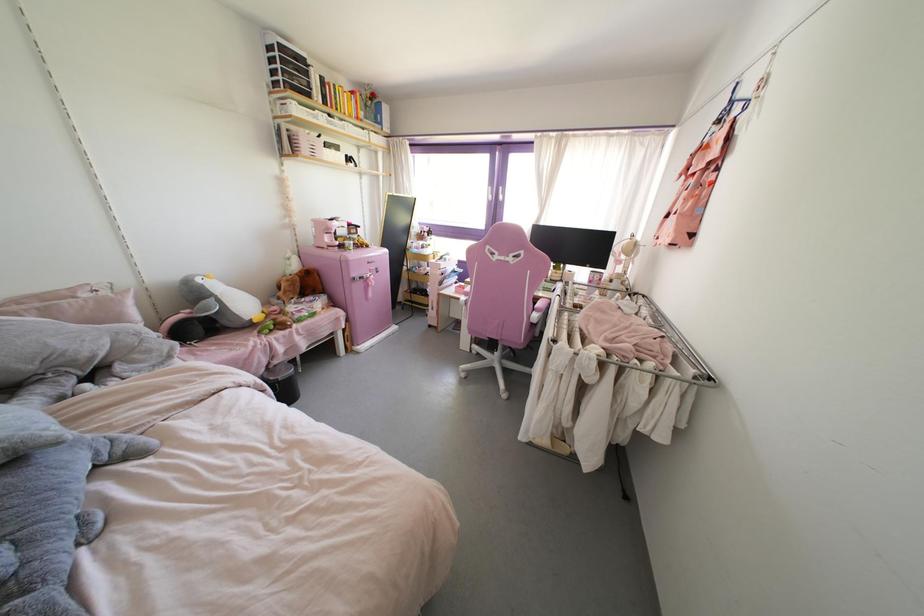
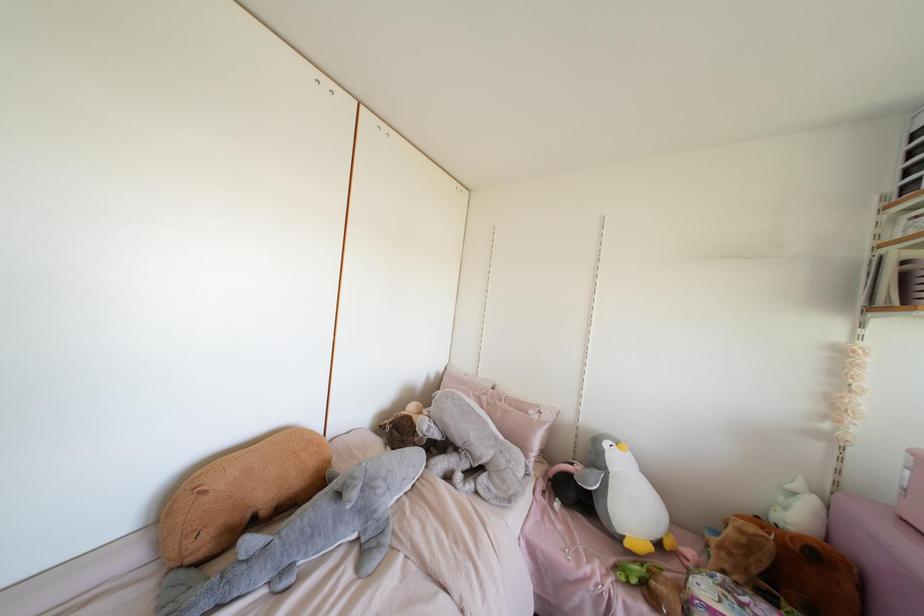
In the second image, find the point that corresponds to point (282, 154) in the first image.

(870, 307)